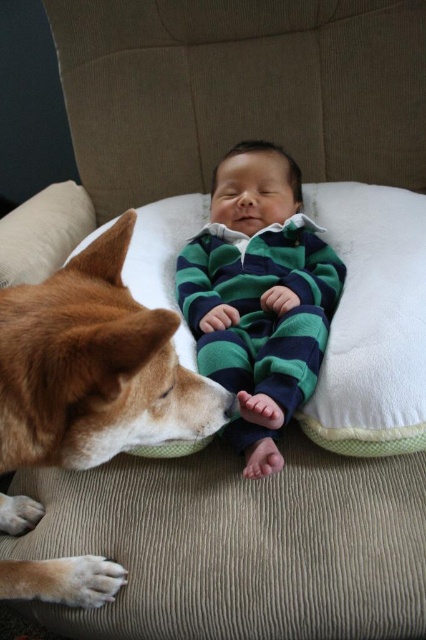
You are a photographer taking a picture of the brown fur dog at lower left and the green striped pajamas at center. Based on their positions, which object is closer to the bottom edge of the photo?

The brown fur dog at lower left is closer to the bottom edge of the photo because it is positioned below the green striped pajamas at center.

You are a photographer taking a picture of the brown fur dog at lower left and the green striped pajamas at center. Based on their positions, which object will appear closer to the camera in the photo?

The brown fur dog at lower left is in front of the green striped pajamas at center, so it will appear closer to the camera in the photo.

You are a photographer setting up a photo shoot for a baby and a dog. The scene requires the brown fur dog at lower left to be positioned closer to the camera than the green striped pajamas at center. Based on their sizes, is this arrangement feasible?

The brown fur dog at lower left has a smaller size compared to the green striped pajamas at center. Since the dog is smaller, positioning it closer to the camera could make it appear larger in the photo, but the size difference might still be noticeable depending on the distance.